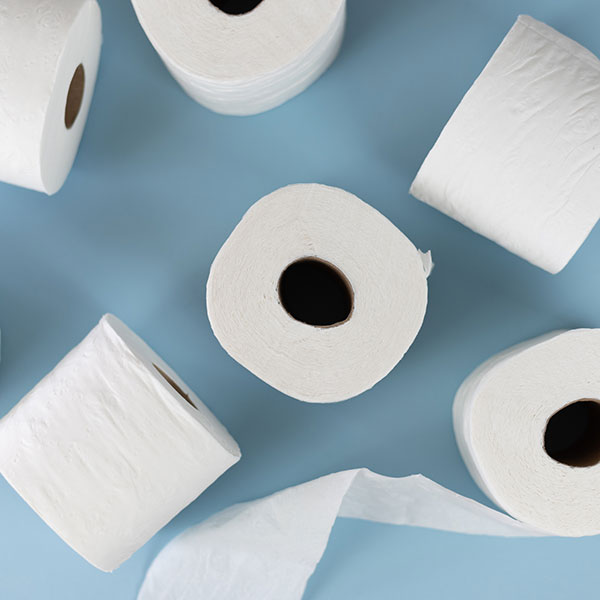
Where is `tissue rolls`? The width and height of the screenshot is (600, 600). tissue rolls is located at coordinates pyautogui.click(x=43, y=95), pyautogui.click(x=241, y=45), pyautogui.click(x=526, y=135), pyautogui.click(x=351, y=317), pyautogui.click(x=83, y=442), pyautogui.click(x=520, y=458).